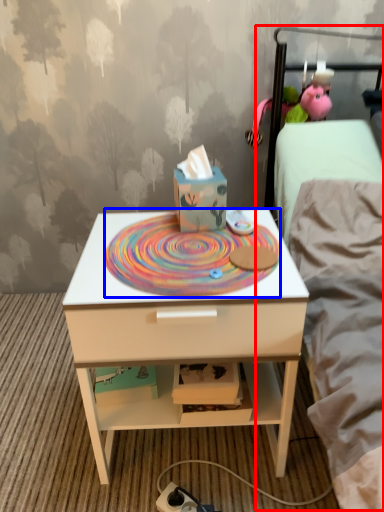
Question: Which point is further to the camera, bed (highlighted by a red box) or design (highlighted by a blue box)?

Choices:
 (A) bed
 (B) design

Answer: (A)